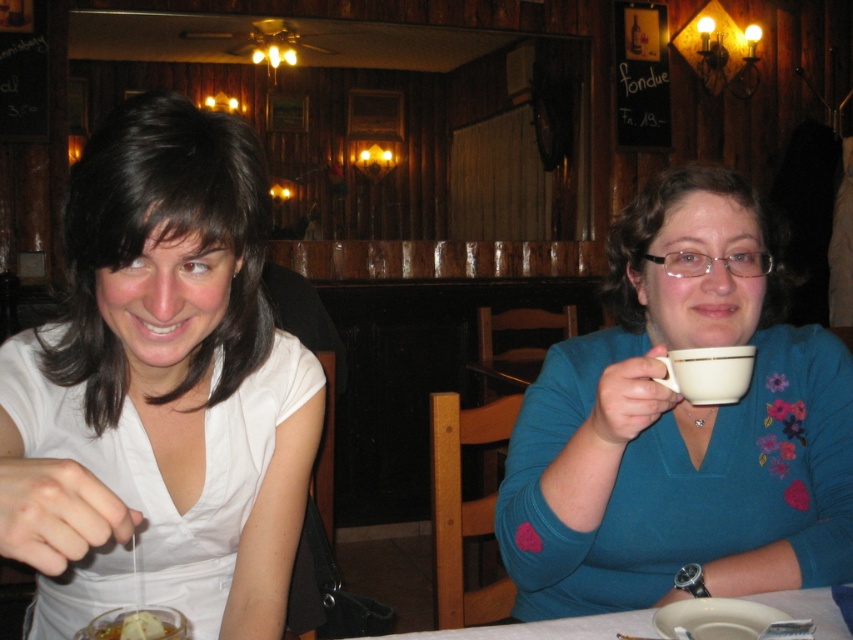
Between teal jersey at upper right and translucent glass bowl at lower left, which one is positioned higher?

teal jersey at upper right

Between teal jersey at upper right and translucent glass bowl at lower left, which one is positioned lower?

translucent glass bowl at lower left

What do you see at coordinates (680, 422) in the screenshot? The image size is (853, 640). I see `teal jersey at upper right` at bounding box center [680, 422].

I want to click on teal jersey at upper right, so click(680, 422).

Between white matte shirt at left and white porcelain mug at upper right, which one appears on the right side from the viewer's perspective?

white porcelain mug at upper right is more to the right.

Between white matte shirt at left and white porcelain mug at upper right, which one appears on the left side from the viewer's perspective?

white matte shirt at left is more to the left.

Who is more forward, (6, 516) or (706, 362)?

Point (6, 516) is more forward.

The image size is (853, 640). I want to click on white matte shirt at left, so click(160, 378).

Does point (703, 376) lie in front of point (177, 611)?

That is False.

Does white porcelain mug at upper right appear under translucent glass bowl at lower left?

No, white porcelain mug at upper right is not below translucent glass bowl at lower left.

Between point (740, 378) and point (172, 628), which one is positioned behind?

The point (740, 378) is behind.

The image size is (853, 640). In order to click on white porcelain mug at upper right in this screenshot , I will do `click(709, 372)`.